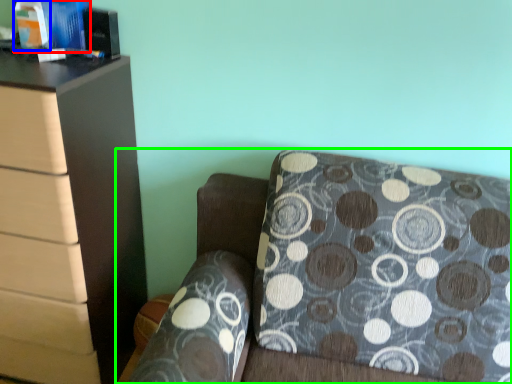
Question: Which is nearer to the book (highlighted by a red box)? book (highlighted by a blue box) or furniture (highlighted by a green box).

Choices:
 (A) book
 (B) furniture

Answer: (A)